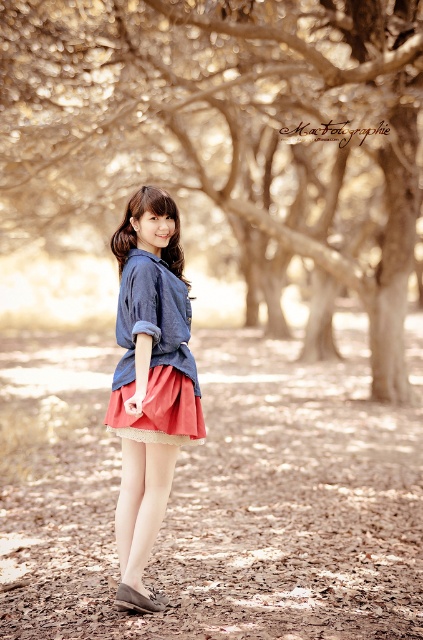
Can you confirm if brown textured tree at center is positioned above brown dirt field at lower center?

Yes.

In the scene shown: Can you confirm if brown textured tree at center is positioned to the left of brown dirt field at lower center?

Correct, you'll find brown textured tree at center to the left of brown dirt field at lower center.

Locate an element on the screen. brown textured tree at center is located at coordinates (230, 132).

Find the location of `brown textured tree at center`. brown textured tree at center is located at coordinates (230, 132).

Is point (302, 156) in front of point (151, 326)?

No, (302, 156) is further to viewer.

Is brown textured tree at center smaller than denim jacket at center?

Actually, brown textured tree at center might be larger than denim jacket at center.

Is point (332, 348) less distant than point (180, 291)?

No, it is not.

Locate an element on the screen. brown textured tree at center is located at coordinates (230, 132).

Which is above, matte pink skirt at center or matte blue shirt at center?

matte blue shirt at center

Is point (137, 435) behind point (156, 209)?

No, it is not.

Image resolution: width=423 pixels, height=640 pixels. I want to click on matte pink skirt at center, so click(159, 410).